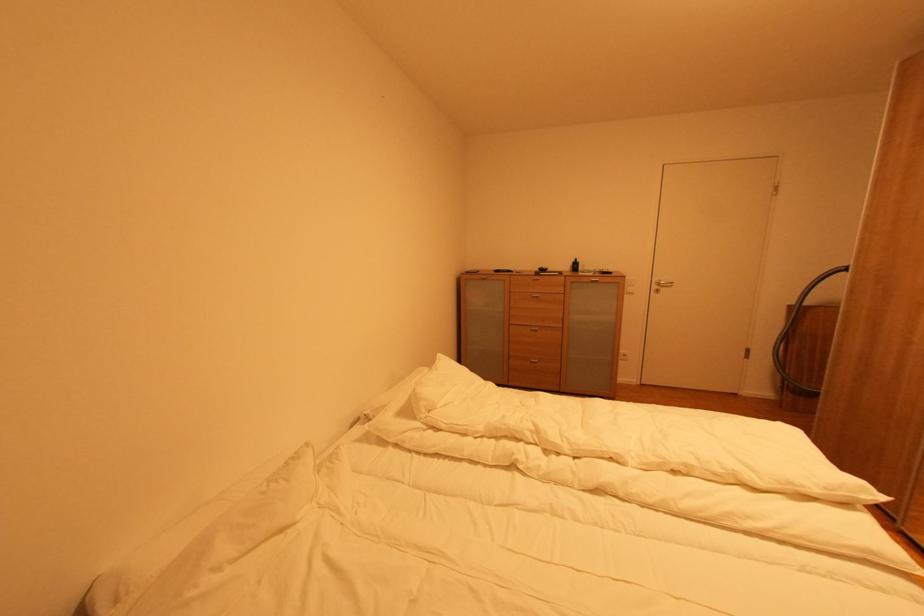
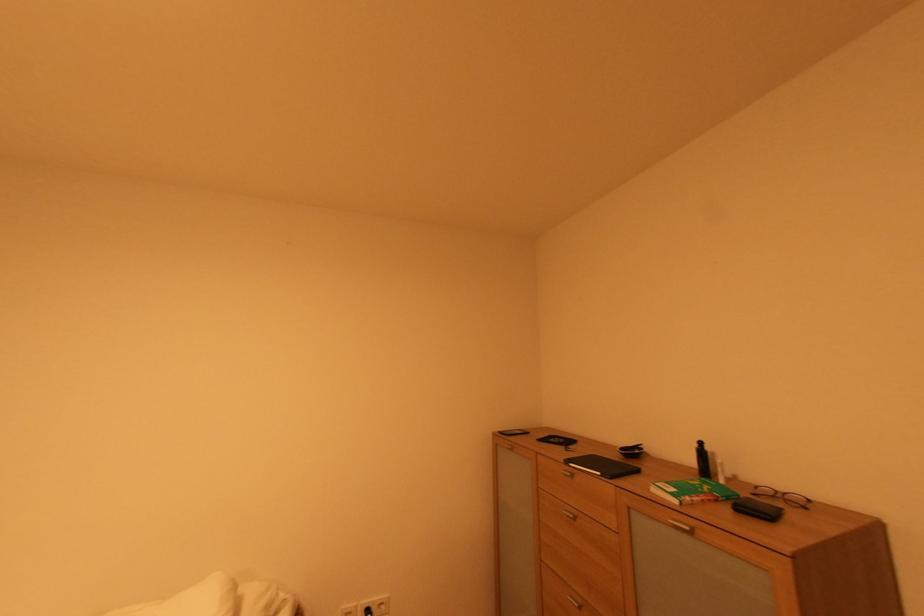
In the second image, find the point that corresponds to the point at 579,262 in the first image.

(701, 447)